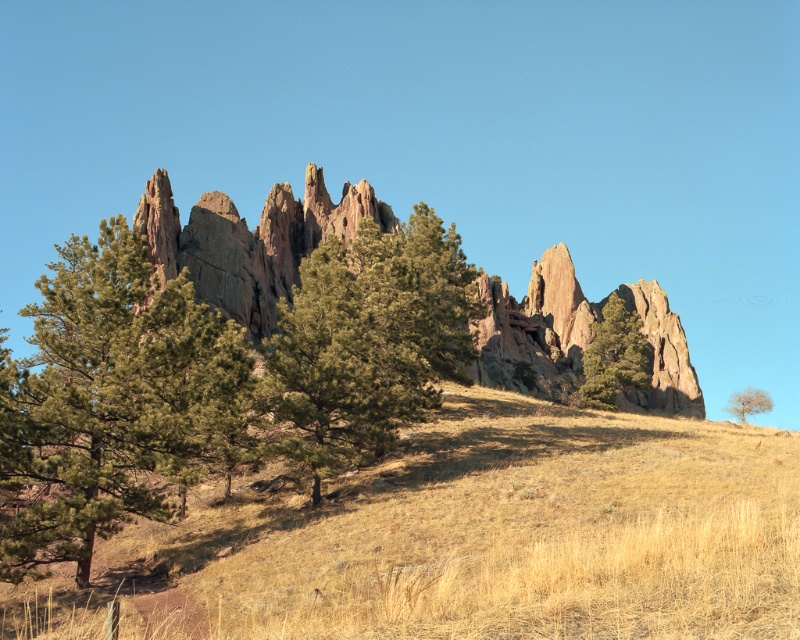
Question: Which of the following is the closest to the observer?

Choices:
 (A) green textured pine tree at left
 (B) dry grass at center
 (C) green matte tree at center

Answer: (B)

Question: Considering the relative positions of dry grass at center and smooth brown tree at right in the image provided, where is dry grass at center located with respect to smooth brown tree at right?

Choices:
 (A) left
 (B) right

Answer: (A)

Question: Estimate the real-world distances between objects in this image. Which object is closer to the dry grass at center?

Choices:
 (A) green matte tree at center
 (B) green textured tree at center
 (C) green textured pine tree at left

Answer: (A)

Question: Is dry grass at center behind green matte tree at center?

Choices:
 (A) yes
 (B) no

Answer: (B)

Question: Can you confirm if green textured pine tree at left is wider than green textured tree at center?

Choices:
 (A) no
 (B) yes

Answer: (A)

Question: Which of the following is the farthest from the observer?

Choices:
 (A) dry grass at center
 (B) green matte tree at center
 (C) smooth brown tree at right
 (D) green textured tree at center

Answer: (C)